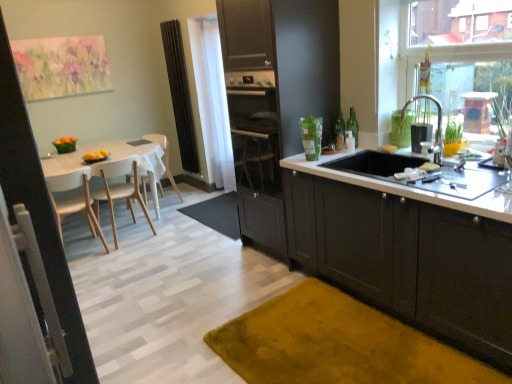
Question: Considering the relative positions of white glossy countertop at lower right and glossy dark wood cabinets at center, the second cabinetry from the right, in the image provided, is white glossy countertop at lower right in front of glossy dark wood cabinets at center, the second cabinetry from the right,?

Choices:
 (A) no
 (B) yes

Answer: (B)

Question: Is white glossy countertop at lower right to the right of glossy dark wood cabinets at center, arranged as the 1th cabinetry when viewed from the left, from the viewer's perspective?

Choices:
 (A) no
 (B) yes

Answer: (B)

Question: From a real-world perspective, does white glossy countertop at lower right sit lower than glossy dark wood cabinets at center, arranged as the 1th cabinetry when viewed from the left?

Choices:
 (A) yes
 (B) no

Answer: (A)

Question: Is white glossy countertop at lower right wider than glossy dark wood cabinets at center, the second cabinetry from the right?

Choices:
 (A) yes
 (B) no

Answer: (B)

Question: Is white glossy countertop at lower right oriented away from glossy dark wood cabinets at center, arranged as the 1th cabinetry when viewed from the left?

Choices:
 (A) no
 (B) yes

Answer: (A)

Question: Is white wood table at left inside the boundaries of transparent glass window at upper right, or outside?

Choices:
 (A) inside
 (B) outside

Answer: (B)

Question: Is white wood table at left in front of or behind transparent glass window at upper right in the image?

Choices:
 (A) front
 (B) behind

Answer: (B)

Question: Is point (74, 167) closer or farther from the camera than point (408, 72)?

Choices:
 (A) closer
 (B) farther

Answer: (B)

Question: Would you say white wood table at left is to the left or to the right of transparent glass window at upper right in the picture?

Choices:
 (A) left
 (B) right

Answer: (A)

Question: Do you think green glass bottle at upper right, placed as the second bottle when sorted from right to left, is within matte black cabinets at lower right, acting as the 1th cabinetry starting from the right, or outside of it?

Choices:
 (A) outside
 (B) inside

Answer: (A)

Question: Would you say green glass bottle at upper right, placed as the second bottle when sorted from right to left, is to the left or to the right of matte black cabinets at lower right, the second cabinetry viewed from the left, in the picture?

Choices:
 (A) right
 (B) left

Answer: (B)

Question: From a real-world perspective, is green glass bottle at upper right, placed as the second bottle when sorted from right to left, above or below matte black cabinets at lower right, the second cabinetry viewed from the left?

Choices:
 (A) above
 (B) below

Answer: (A)

Question: Is green glass bottle at upper right, placed as the second bottle when sorted from right to left, bigger or smaller than matte black cabinets at lower right, acting as the 1th cabinetry starting from the right?

Choices:
 (A) big
 (B) small

Answer: (B)

Question: From the image's perspective, is white glossy countertop at lower right located above or below white wood chair at left, the second chair viewed from the back?

Choices:
 (A) above
 (B) below

Answer: (A)

Question: Would you say white glossy countertop at lower right is to the left or to the right of white wood chair at left, which is the 2th chair from front to back, in the picture?

Choices:
 (A) right
 (B) left

Answer: (A)